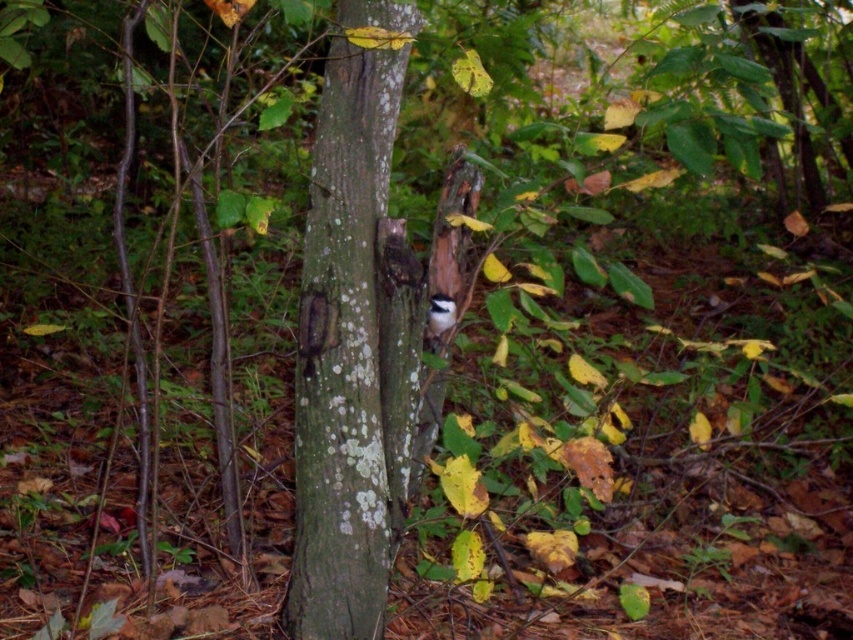
Question: Does green rough bark tree trunk at center have a larger size compared to white fluffy bird at center?

Choices:
 (A) no
 (B) yes

Answer: (B)

Question: Which object appears farthest from the camera in this image?

Choices:
 (A) green rough bark tree trunk at center
 (B) white fluffy bird at center

Answer: (B)

Question: Among these points, which one is farthest from the camera?

Choices:
 (A) (427, 317)
 (B) (335, 460)

Answer: (A)

Question: Does green rough bark tree trunk at center have a larger size compared to white fluffy bird at center?

Choices:
 (A) no
 (B) yes

Answer: (B)

Question: Which object appears farthest from the camera in this image?

Choices:
 (A) green rough bark tree trunk at center
 (B) white fluffy bird at center

Answer: (B)

Question: Is green rough bark tree trunk at center to the left of white fluffy bird at center from the viewer's perspective?

Choices:
 (A) no
 (B) yes

Answer: (B)